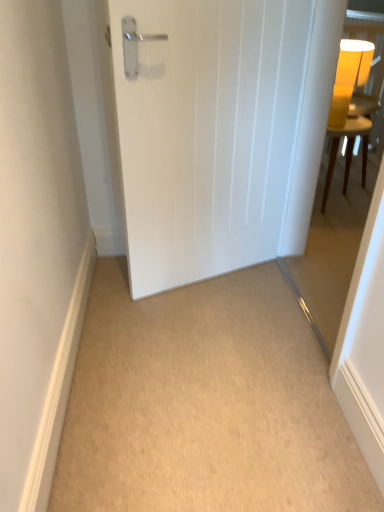
Question: Considering the relative sizes of yellow matte table lamp at upper right and white matte door at center in the image provided, is yellow matte table lamp at upper right bigger than white matte door at center?

Choices:
 (A) yes
 (B) no

Answer: (B)

Question: Is yellow matte table lamp at upper right further to camera compared to white matte door at center?

Choices:
 (A) no
 (B) yes

Answer: (B)

Question: Is yellow matte table lamp at upper right wider than white matte door at center?

Choices:
 (A) yes
 (B) no

Answer: (A)

Question: Could you tell me if yellow matte table lamp at upper right is turned towards white matte door at center?

Choices:
 (A) yes
 (B) no

Answer: (B)

Question: Can you confirm if yellow matte table lamp at upper right is taller than white matte door at center?

Choices:
 (A) yes
 (B) no

Answer: (B)

Question: Does yellow matte table lamp at upper right have a lesser height compared to white matte door at center?

Choices:
 (A) yes
 (B) no

Answer: (A)

Question: Does white matte door at center have a lesser width compared to beige carpet at center?

Choices:
 (A) no
 (B) yes

Answer: (B)

Question: From a real-world perspective, is white matte door at center below beige carpet at center?

Choices:
 (A) no
 (B) yes

Answer: (A)

Question: Is white matte door at center facing away from beige carpet at center?

Choices:
 (A) yes
 (B) no

Answer: (B)

Question: Is white matte door at center facing towards beige carpet at center?

Choices:
 (A) no
 (B) yes

Answer: (B)

Question: Is white matte door at center wider than beige carpet at center?

Choices:
 (A) yes
 (B) no

Answer: (B)

Question: Is the depth of white matte door at center greater than that of beige carpet at center?

Choices:
 (A) no
 (B) yes

Answer: (B)

Question: Does transparent glass door at right have a lesser width compared to white matte door at center?

Choices:
 (A) yes
 (B) no

Answer: (B)